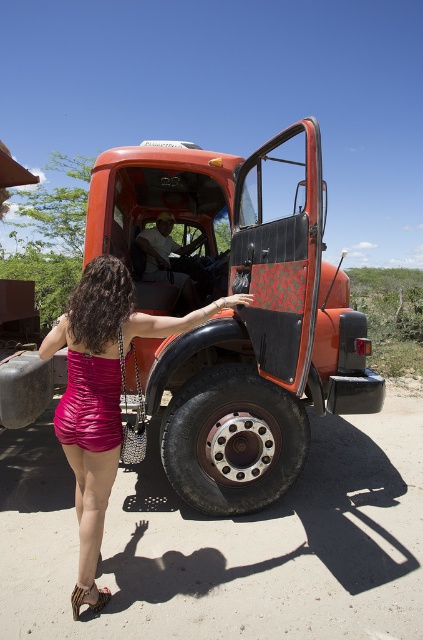
Question: Where is metallic red truck at center located in relation to shiny pink dress at center in the image?

Choices:
 (A) left
 (B) right

Answer: (B)

Question: Is metallic red truck at center positioned behind leather textured sandal at lower left?

Choices:
 (A) no
 (B) yes

Answer: (B)

Question: Which point appears closest to the camera in this image?

Choices:
 (A) (275, 474)
 (B) (69, 433)

Answer: (B)

Question: Which point is farther from the camera taking this photo?

Choices:
 (A) (257, 456)
 (B) (206, 461)

Answer: (A)

Question: Which of these objects is positioned farthest from the black rubber tire at lower center?

Choices:
 (A) shiny pink dress at center
 (B) metallic red truck at center

Answer: (A)

Question: Is shiny pink dress at center smaller than black rubber tire at lower center?

Choices:
 (A) yes
 (B) no

Answer: (B)